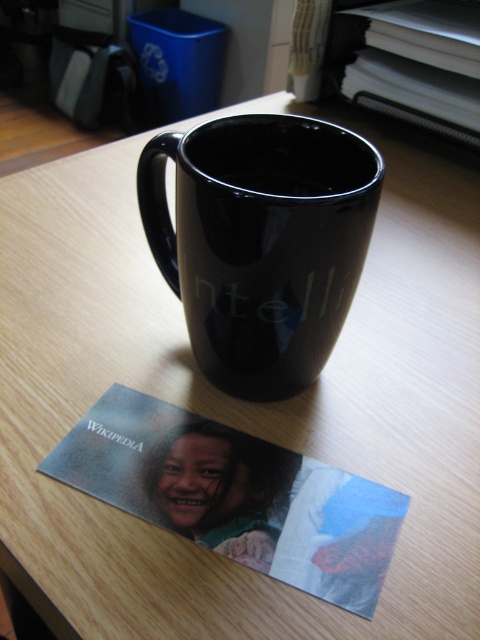
Question: Does glossy ceramic mug at center have a smaller size compared to glossy paper postcard at lower center?

Choices:
 (A) yes
 (B) no

Answer: (B)

Question: Which point is farther from the camera taking this photo?

Choices:
 (A) (144, 458)
 (B) (262, 248)

Answer: (A)

Question: Observing the image, what is the correct spatial positioning of glossy ceramic mug at center in reference to glossy paper postcard at lower center?

Choices:
 (A) below
 (B) above

Answer: (B)

Question: Which point is closer to the camera taking this photo?

Choices:
 (A) (140, 476)
 (B) (332, 298)

Answer: (A)

Question: Can you confirm if glossy ceramic mug at center is wider than glossy paper postcard at lower center?

Choices:
 (A) no
 (B) yes

Answer: (A)